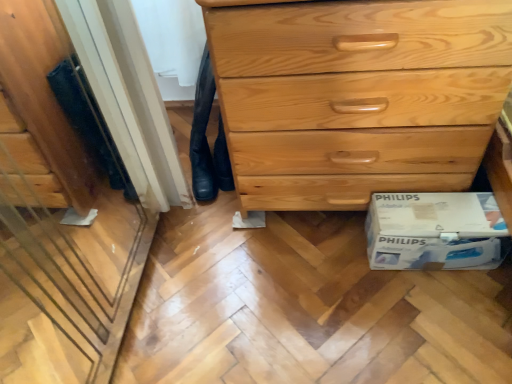
Image resolution: width=512 pixels, height=384 pixels. I want to click on vacant space situated above white cardboard box at lower right (from a real-world perspective), so click(x=440, y=210).